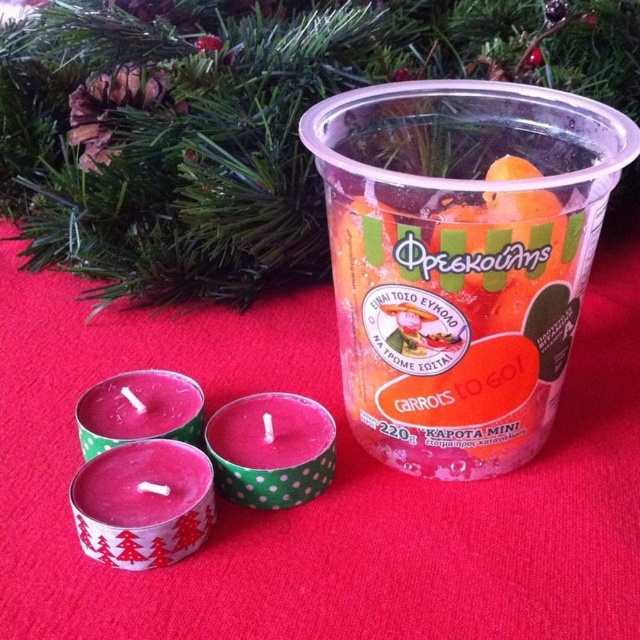
You are setting up a table for a Christmas party and have two candles, the matte pink candle at lower left and the pink wax candle at center. You want to place them so that one is visible from the main entrance. Which candle should you position closer to the entrance?

The matte pink candle at lower left should be positioned closer to the entrance because it is in front of the pink wax candle at center, making it more visible from the entrance.

You are setting up a holiday table and have the translucent plastic cup at center and the pink polka dot candle at center. According to the image, which item is placed higher up?

The translucent plastic cup at center is located above the pink polka dot candle at center, so the cup is placed higher up.

You are setting up a table for a Christmas party and have a translucent plastic cup at center and a pink polka dot candle at center. You want to place a small gift box between them. Can the gift box fit horizontally between the two items?

The translucent plastic cup at center is taller than the pink polka dot candle at center, but the question is about horizontal space. Since both items are at the center, there is no space between them for the gift box to fit horizontally.